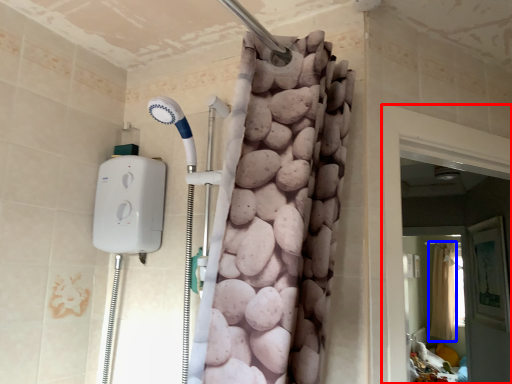
Question: Which object is further to the camera taking this photo, screen door (highlighted by a red box) or shower curtain (highlighted by a blue box)?

Choices:
 (A) screen door
 (B) shower curtain

Answer: (B)